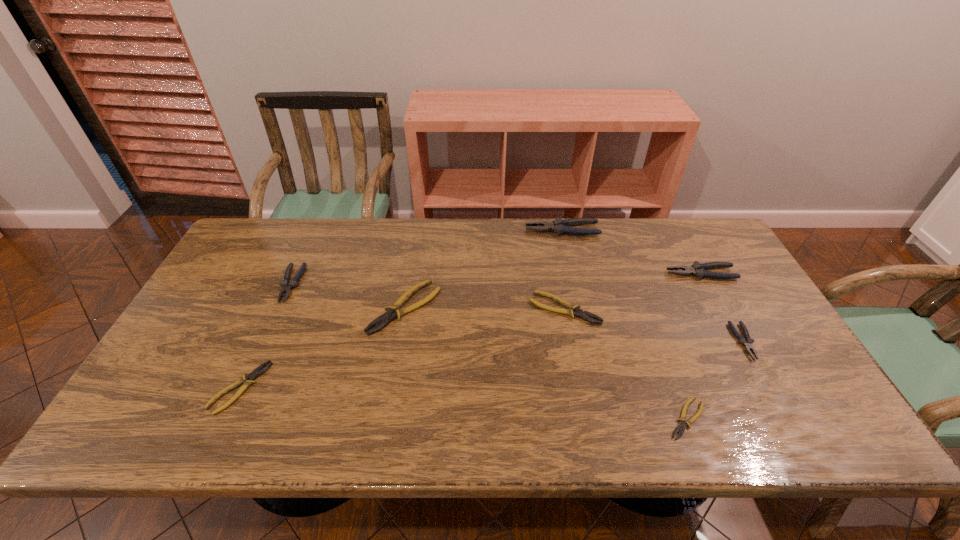
What are the coordinates of `vacant space located 0.260m on the front of the sixth pliers from right to left` in the screenshot? It's located at (385, 428).

Locate an element on the screen. free space located on the left of the third smallest yellow pliers is located at coordinates (466, 308).

Find the location of a particular element. Image resolution: width=960 pixels, height=540 pixels. free space located 0.130m at the gripping part of the smallest gray pliers is located at coordinates (780, 407).

Find the location of a particular element. vacant space situated on the right of the leftmost yellow pliers is located at coordinates (372, 388).

Locate an element on the screen. The width and height of the screenshot is (960, 540). vacant area situated 0.330m on the back of the rightmost yellow pliers is located at coordinates (642, 298).

Where is `object present at the far edge`? Image resolution: width=960 pixels, height=540 pixels. object present at the far edge is located at coordinates (559, 226).

Find the location of a particular element. The image size is (960, 540). vacant space at the far edge is located at coordinates (648, 240).

In the image, there is a desktop. At what (x,y) coordinates should I click in order to perform the action: click on vacant space at the near edge. Please return your answer as a coordinate pair (x, y). Looking at the image, I should click on (287, 430).

Where is `free region at the right edge`? The width and height of the screenshot is (960, 540). free region at the right edge is located at coordinates (755, 376).

The height and width of the screenshot is (540, 960). In the image, there is a desktop. What are the coordinates of `vacant space at the far left corner` in the screenshot? It's located at (291, 230).